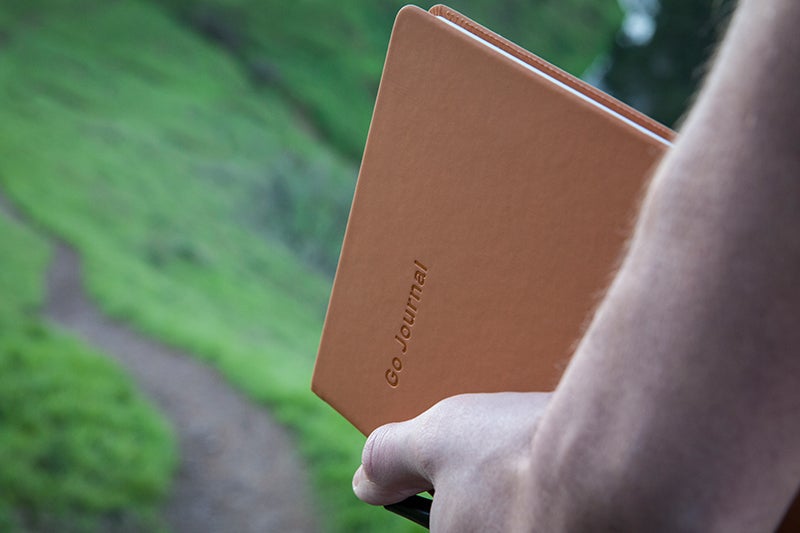
The height and width of the screenshot is (533, 800). Identify the location of flat surfaces. (501, 241).